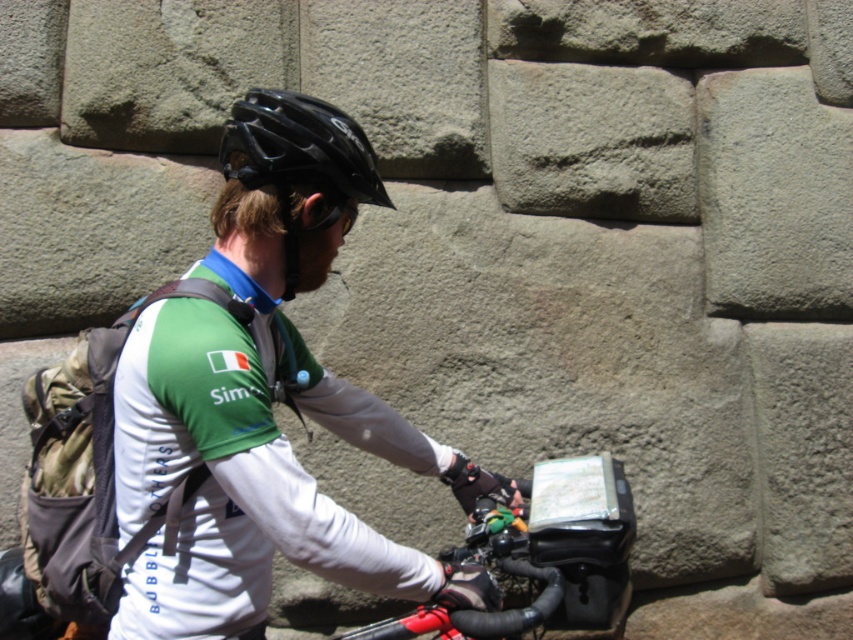
You are a cyclist who just arrived at a crossroads and need to decide which path to take. You look at your navigation device mounted on the handlebars and see a point marked at coordinates [592,140]. Based on the scene, what does this point represent?

The point at coordinates [592,140] on the navigation device corresponds to gray rough stone at upper center, which is likely a landmark to help you navigate.

You are a photographer capturing the cyclist. You need to ensure both the matte black helmet at upper center and the black matte helmet at upper center are clearly visible in the photo. Since one is much taller than the other, which one might block the view of the other?

The matte black helmet at upper center is much taller than the black matte helmet at upper center, so it might block the view of the black matte helmet at upper center.

You are a tour guide standing 1.6 meters away from the cyclist. You want to hand them a brochure. Is the matte black helmet at upper center within your reach?

The matte black helmet at upper center is 1.69 meters from the viewer. Since you are standing 1.6 meters away, the helmet is just slightly out of reach.